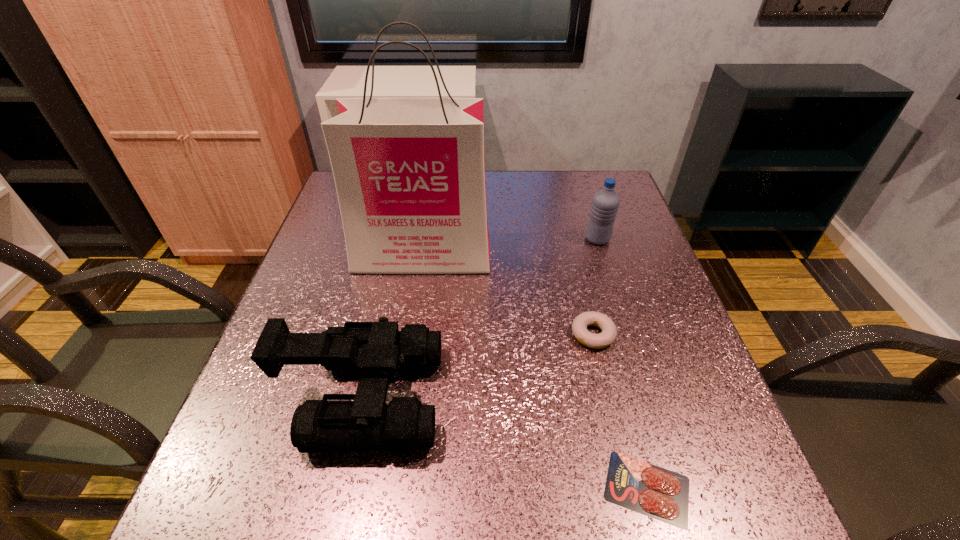
Choose which object is the second nearest neighbor to the binoculars. Please provide its 2D coordinates. Your answer should be formatted as a tuple, i.e. [(x, y)], where the tuple contains the x and y coordinates of a point satisfying the conditions above.

[(608, 335)]

In order to click on free location that satisfies the following two spatial constraints: 1. on the front-facing side of the salami; 2. on the left side of the tallest object in this screenshot , I will do `click(388, 488)`.

Image resolution: width=960 pixels, height=540 pixels. What are the coordinates of `free location that satisfies the following two spatial constraints: 1. on the front-facing side of the shopping bag; 2. on the right side of the second shortest object` in the screenshot? It's located at (411, 335).

Where is `free space in the image that satisfies the following two spatial constraints: 1. on the front-facing side of the second shortest object; 2. on the left side of the tallest object`? The image size is (960, 540). free space in the image that satisfies the following two spatial constraints: 1. on the front-facing side of the second shortest object; 2. on the left side of the tallest object is located at coordinates (411, 335).

Identify the location of free space that satisfies the following two spatial constraints: 1. on the front-facing side of the salami; 2. on the right side of the tallest object. This screenshot has height=540, width=960. tap(388, 488).